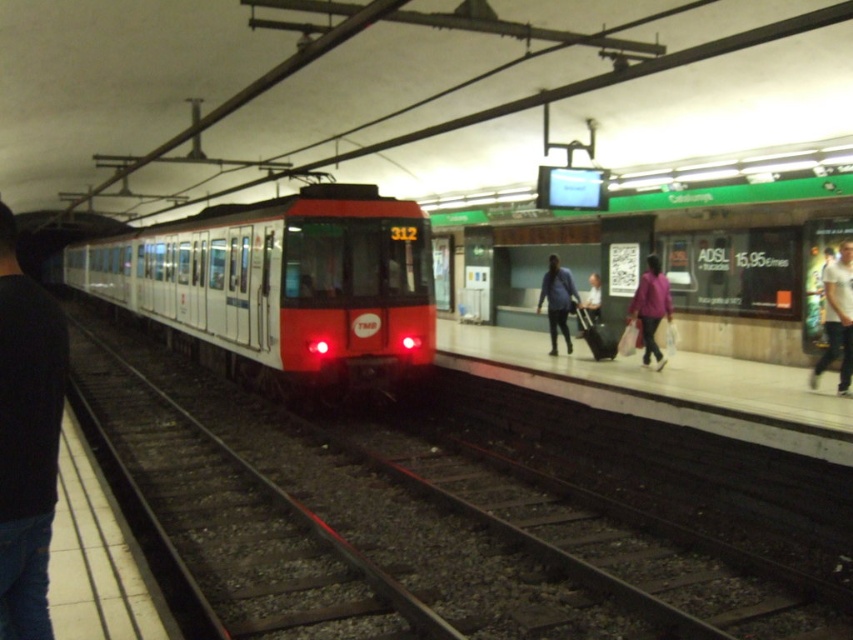
You are a commuter waiting on the subway platform and see both the white cotton shirt at right and the purple fabric jacket at right. Which clothing item is smaller in size?

The white cotton shirt at right is smaller than the purple fabric jacket at right.

You are standing on the subway platform and want to find the white metal track at center. According to the scene description, where would you look to locate it?

The white metal track at center is located at point [419,518].